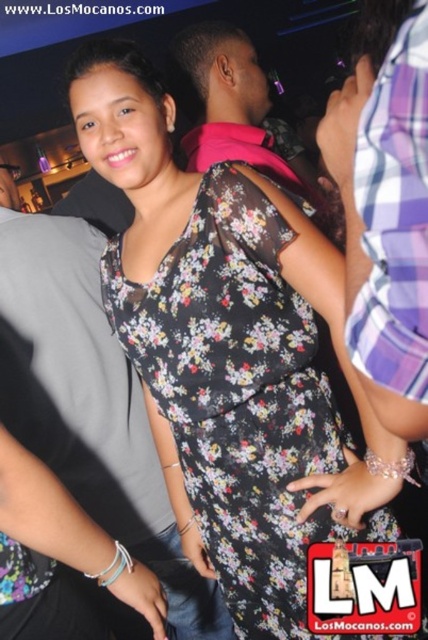
Question: Is floral-patterned fabric dress at center wider than gray fabric shirt at upper left?

Choices:
 (A) yes
 (B) no

Answer: (A)

Question: Is floral-patterned fabric dress at center wider than gray fabric shirt at upper left?

Choices:
 (A) no
 (B) yes

Answer: (B)

Question: Which point is closer to the camera taking this photo?

Choices:
 (A) (267, 529)
 (B) (88, 564)

Answer: (B)

Question: Is floral-patterned fabric dress at center above gray fabric shirt at upper left?

Choices:
 (A) no
 (B) yes

Answer: (B)

Question: Which of the following is the closest to the observer?

Choices:
 (A) (294, 305)
 (B) (35, 248)

Answer: (A)